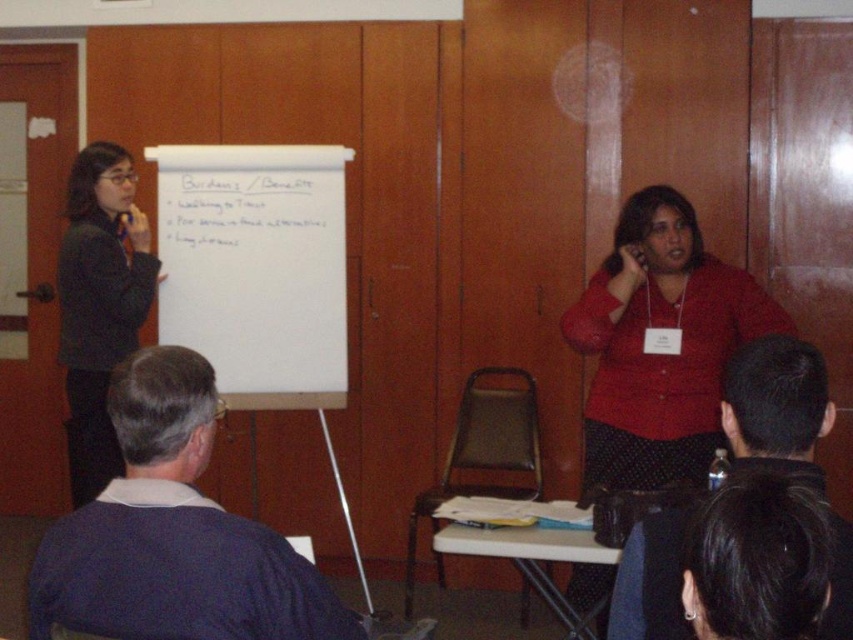
You are attending a meeting in the conference room. You need to refer to the whiteboard at upper left and the white paper at upper center. Which object is positioned higher in the room?

The white paper at upper center is positioned higher than the whiteboard at upper left because the whiteboard at upper left is below white paper at upper center.

Consider the image. You are organizing a small event and need to place a 10 cm thick decorative plaque between the dark blue sweater at left and the whiteboard at upper left. Can you fit it there?

The dark blue sweater at left is thinner than the whiteboard at upper left, so the space between them may be sufficient to place the 10 cm thick decorative plaque. However, without knowing the exact distance between them, it is uncertain if there is enough space.

You are an attendee in the conference room. You want to take a photo of the whiteboard at upper left. The camera you have can only focus on objects within a 0.3 meter radius. Can you focus on the whiteboard at upper left from your current position at point (256, 268)?

The point (256, 268) corresponds to the whiteboard at upper left, so yes, you can focus on the whiteboard at upper left from your current position since you are already at the correct coordinates.